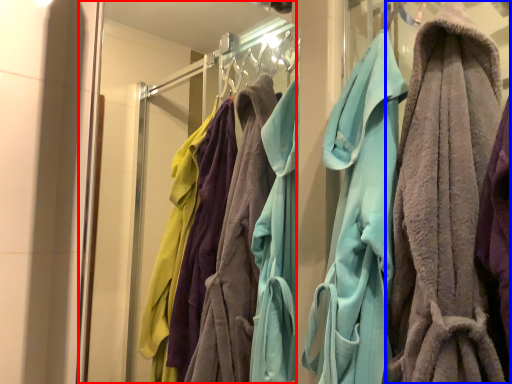
Question: Among these objects, which one is nearest to the camera, glass door (highlighted by a red box) or towel (highlighted by a blue box)?

Choices:
 (A) glass door
 (B) towel

Answer: (B)